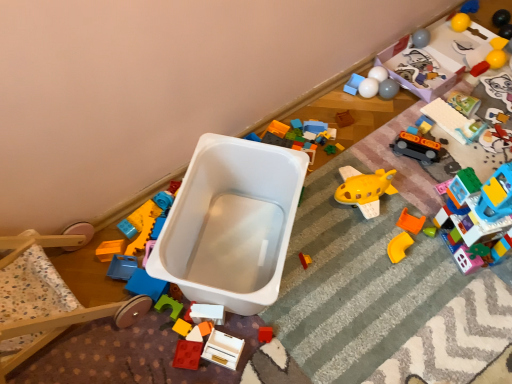
Locate an element on the screen. This screenshot has width=512, height=384. empty space that is in between matte gray cat at upper right, which is the fifteenth toy in left-to-right order, and white plastic baby carriage at center is located at coordinates (394, 177).